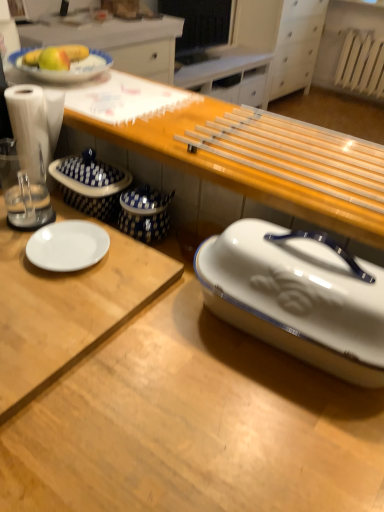
You are a GUI agent. You are given a task and a screenshot of the screen. Output one action in this format:
    pyautogui.click(x=<x>, y=<y>)
    Task: Click on the empty space that is ontop of wooden table at center
    
    Given the screenshot: What is the action you would take?
    pyautogui.click(x=196, y=117)